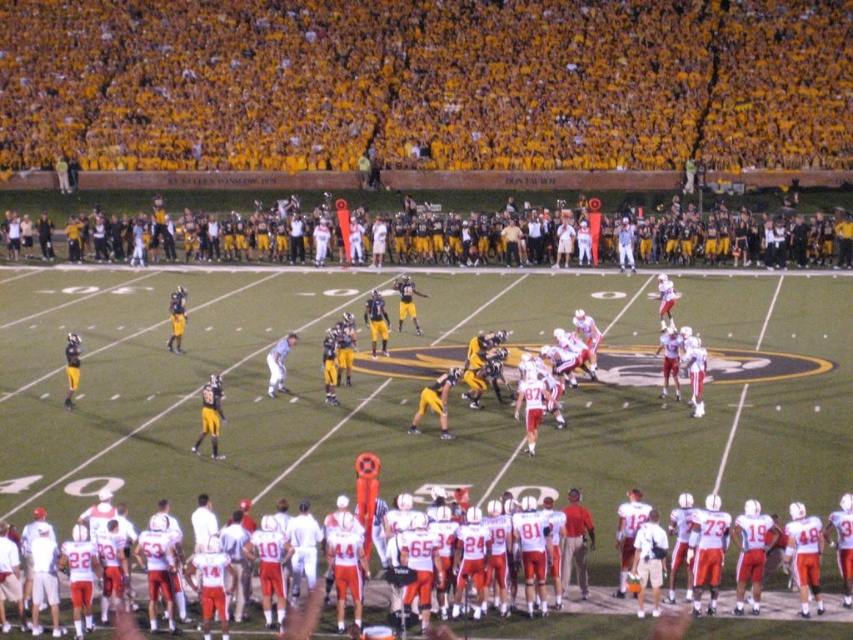
Question: Does yellow/yellowish fabric at upper center appear on the right side of white matte uniform at center?

Choices:
 (A) yes
 (B) no

Answer: (B)

Question: Considering the relative positions of yellow/yellowish fabric at upper center and white matte uniform at center in the image provided, where is yellow/yellowish fabric at upper center located with respect to white matte uniform at center?

Choices:
 (A) left
 (B) right

Answer: (A)

Question: Is yellow/yellowish fabric at upper center to the left of white matte uniform at center from the viewer's perspective?

Choices:
 (A) no
 (B) yes

Answer: (B)

Question: Which object is farther from the camera taking this photo?

Choices:
 (A) white matte uniform at center
 (B) yellow/yellowish fabric at upper center

Answer: (B)